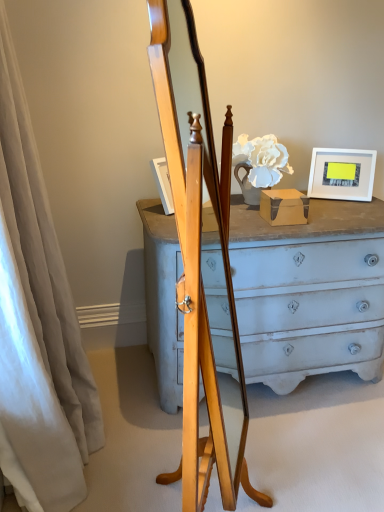
The height and width of the screenshot is (512, 384). What do you see at coordinates (37, 324) in the screenshot? I see `white fabric curtain at left` at bounding box center [37, 324].

I want to click on white fabric curtain at left, so click(x=37, y=324).

You are a GUI agent. You are given a task and a screenshot of the screen. Output one action in this format:
    pyautogui.click(x=<x>, y=<y>)
    Task: Click on the white matte picture frame at upper right
    
    Given the screenshot: What is the action you would take?
    pyautogui.click(x=342, y=174)

What do you see at coordinates (342, 174) in the screenshot?
I see `white matte picture frame at upper right` at bounding box center [342, 174].

The width and height of the screenshot is (384, 512). Find the location of `white fabric curtain at left`. white fabric curtain at left is located at coordinates (37, 324).

Can you confirm if white matte picture frame at upper right is positioned to the right of white fabric curtain at left?

Indeed, white matte picture frame at upper right is positioned on the right side of white fabric curtain at left.

Is white matte picture frame at upper right behind white fabric curtain at left?

Yes, the depth of white matte picture frame at upper right is greater than that of white fabric curtain at left.

Does point (341, 185) lie behind point (24, 106)?

Yes, it is.

From the image's perspective, is white matte picture frame at upper right above or below white fabric curtain at left?

Clearly, from the image's perspective, white matte picture frame at upper right is above white fabric curtain at left.

From a real-world perspective, is white matte picture frame at upper right beneath white fabric curtain at left?

No, from a real-world perspective, white matte picture frame at upper right is not under white fabric curtain at left.

Considering the sizes of white matte picture frame at upper right and white fabric curtain at left in the image, is white matte picture frame at upper right wider or thinner than white fabric curtain at left?

Clearly, white matte picture frame at upper right has less width compared to white fabric curtain at left.

Considering the sizes of white matte picture frame at upper right and white fabric curtain at left in the image, is white matte picture frame at upper right taller or shorter than white fabric curtain at left?

Considering their sizes, white matte picture frame at upper right has less height than white fabric curtain at left.

Consider the image. Between white matte picture frame at upper right and white fabric curtain at left, which one has larger size?

Bigger between the two is white fabric curtain at left.

Is white matte picture frame at upper right completely or partially outside of white fabric curtain at left?

white matte picture frame at upper right lies outside white fabric curtain at left's area.

Can you see white matte picture frame at upper right touching white fabric curtain at left?

There is a gap between white matte picture frame at upper right and white fabric curtain at left.

Is white matte picture frame at upper right turned away from white fabric curtain at left?

No, white matte picture frame at upper right is not facing the opposite direction of white fabric curtain at left.

How far apart are white matte picture frame at upper right and white fabric curtain at left?

The distance of white matte picture frame at upper right from white fabric curtain at left is 1.39 meters.

What are the coordinates of `curtain that is under the white matte picture frame at upper right (from a real-world perspective)` in the screenshot? It's located at (37, 324).

Considering the positions of objects white fabric curtain at left and white matte picture frame at upper right in the image provided, who is more to the right, white fabric curtain at left or white matte picture frame at upper right?

white matte picture frame at upper right.

Is white fabric curtain at left behind white matte picture frame at upper right?

No, white fabric curtain at left is closer to the viewer.

Is point (16, 242) farther from viewer compared to point (320, 176)?

No, it is not.

From the image's perspective, between white fabric curtain at left and white matte picture frame at upper right, who is located below?

white fabric curtain at left.

From a real-world perspective, is white fabric curtain at left positioned above or below white matte picture frame at upper right?

Clearly, from a real-world perspective, white fabric curtain at left is below white matte picture frame at upper right.

Considering the relative sizes of white fabric curtain at left and white matte picture frame at upper right in the image provided, is white fabric curtain at left wider than white matte picture frame at upper right?

Correct, the width of white fabric curtain at left exceeds that of white matte picture frame at upper right.

In the scene shown: Considering the relative sizes of white fabric curtain at left and white matte picture frame at upper right in the image provided, is white fabric curtain at left taller than white matte picture frame at upper right?

Yes, white fabric curtain at left is taller than white matte picture frame at upper right.

Considering the relative sizes of white fabric curtain at left and white matte picture frame at upper right in the image provided, is white fabric curtain at left smaller than white matte picture frame at upper right?

Actually, white fabric curtain at left might be larger than white matte picture frame at upper right.

Is white fabric curtain at left located outside white matte picture frame at upper right?

Absolutely, white fabric curtain at left is external to white matte picture frame at upper right.

Are white fabric curtain at left and white matte picture frame at upper right located far from each other?

Absolutely, white fabric curtain at left is distant from white matte picture frame at upper right.

Is white fabric curtain at left turned away from white matte picture frame at upper right?

No.

How different are the orientations of white fabric curtain at left and white matte picture frame at upper right in degrees?

27 degrees.

Looking at this image, measure the distance from white fabric curtain at left to white matte picture frame at upper right.

white fabric curtain at left is 4.56 feet from white matte picture frame at upper right.

Identify the location of picture frame on the right side of white fabric curtain at left. (342, 174).

Locate an element on the screen. Image resolution: width=384 pixels, height=512 pixels. picture frame behind the white fabric curtain at left is located at coordinates (342, 174).

The width and height of the screenshot is (384, 512). Find the location of `curtain that appears in front of the white matte picture frame at upper right`. curtain that appears in front of the white matte picture frame at upper right is located at coordinates (37, 324).